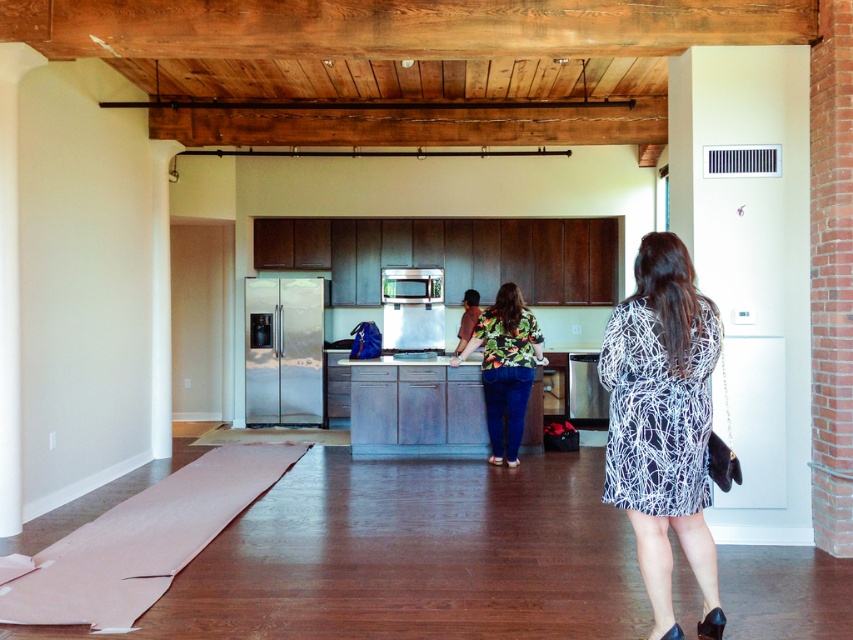
Question: Is stainless steel refrigerator at left closer to camera compared to floral print dress at center?

Choices:
 (A) no
 (B) yes

Answer: (A)

Question: Does stainless steel refrigerator at left lie in front of satin silver microwave at center?

Choices:
 (A) no
 (B) yes

Answer: (B)

Question: Among these objects, which one is farthest from the camera?

Choices:
 (A) floral print dress at center
 (B) pink fabric yoga mat at lower left
 (C) satin silver trash can at lower center
 (D) black printed dress at lower right

Answer: (C)

Question: Is floral print dress at center above satin silver trash can at lower center?

Choices:
 (A) no
 (B) yes

Answer: (B)

Question: Among these objects, which one is nearest to the camera?

Choices:
 (A) pink fabric yoga mat at lower left
 (B) black printed dress at lower right
 (C) satin silver microwave at center
 (D) floral print dress at center

Answer: (B)

Question: Which is farther from the satin silver microwave at center?

Choices:
 (A) satin silver trash can at lower center
 (B) stainless steel refrigerator at left
 (C) floral print dress at center
 (D) black printed dress at lower right

Answer: (D)